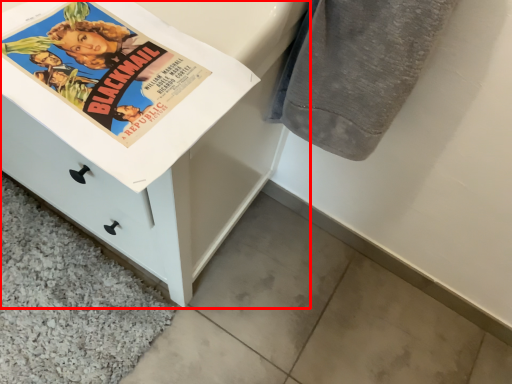
Question: From the image's perspective, where is chest of drawers (annotated by the red box) located in relation to bath towel in the image?

Choices:
 (A) below
 (B) above

Answer: (B)